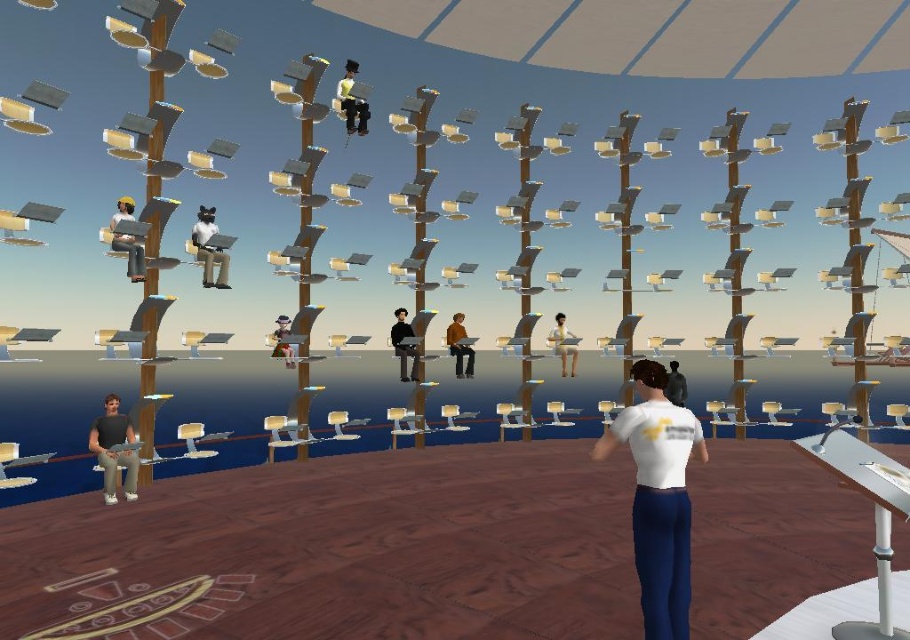
Question: Which point appears farthest from the camera in this image?

Choices:
 (A) coord(226,260)
 (B) coord(105,433)
 (C) coord(284,360)
 (D) coord(461,314)

Answer: (C)

Question: Which point appears closest to the camera in this image?

Choices:
 (A) (567, 369)
 (B) (282, 324)
 (C) (448, 344)

Answer: (C)

Question: Is white plush cat at center to the left of brown leather jacket at center from the viewer's perspective?

Choices:
 (A) no
 (B) yes

Answer: (B)

Question: Does matte black jacket at center come behind light brown wooden chair at center?

Choices:
 (A) no
 (B) yes

Answer: (A)

Question: Can you confirm if dark gray shirt at lower left is thinner than light brown wooden chair at center?

Choices:
 (A) yes
 (B) no

Answer: (B)

Question: Among these objects, which one is nearest to the camera?

Choices:
 (A) white matte shirt at lower right
 (B) brown leather jacket at center
 (C) white plush cat at center
 (D) light brown wooden chair at center

Answer: (A)